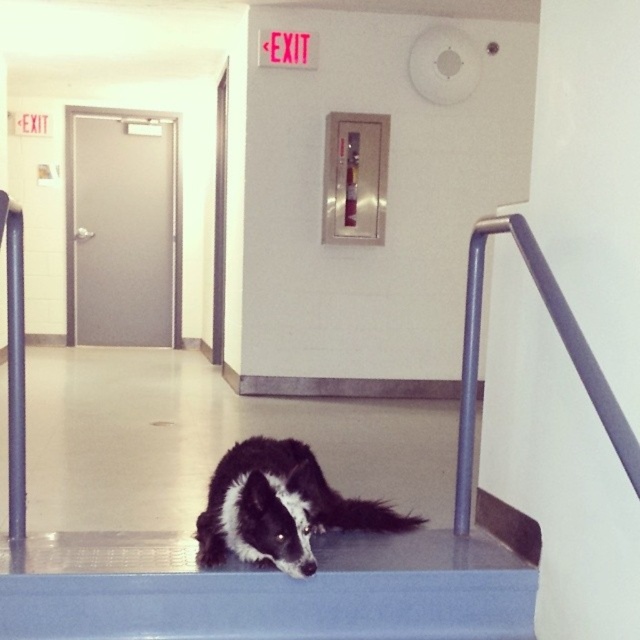
Find the location of `gray metallic door at left`. gray metallic door at left is located at coordinates (124, 230).

Is gray metallic door at left above black fur dog at center?

Correct, gray metallic door at left is located above black fur dog at center.

Find the location of a particular element. gray metallic door at left is located at coordinates (124, 230).

I want to click on gray metallic door at left, so click(x=124, y=230).

The height and width of the screenshot is (640, 640). What do you see at coordinates (563, 346) in the screenshot?
I see `metallic gray handrail at upper right` at bounding box center [563, 346].

Which is behind, point (476, 244) or point (400, 513)?

The point (400, 513) is more distant.

I want to click on metallic gray handrail at upper right, so click(x=563, y=346).

Who is more distant from viewer, (112,131) or (360,504)?

Point (112,131)

Can you confirm if gray metallic door at left is thinner than black fur tail at lower center?

No, gray metallic door at left is not thinner than black fur tail at lower center.

Who is more distant from viewer, (x=93, y=314) or (x=396, y=513)?

The point (x=93, y=314) is more distant.

Find the location of a particular element. This screenshot has height=640, width=640. gray metallic door at left is located at coordinates (124, 230).